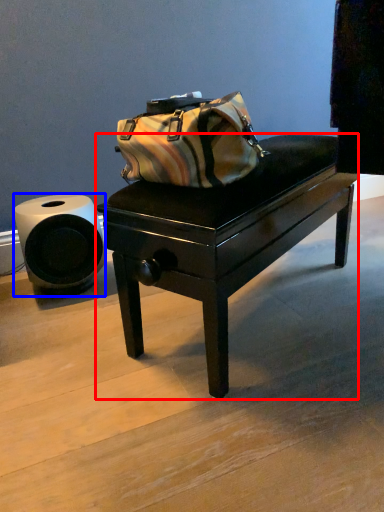
Question: Which object appears farthest to the camera in this image, table (highlighted by a red box) or toilet paper (highlighted by a blue box)?

Choices:
 (A) table
 (B) toilet paper

Answer: (B)